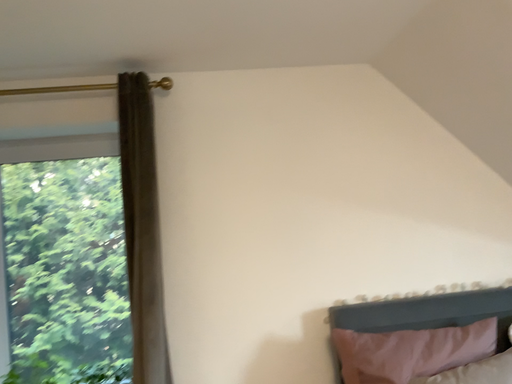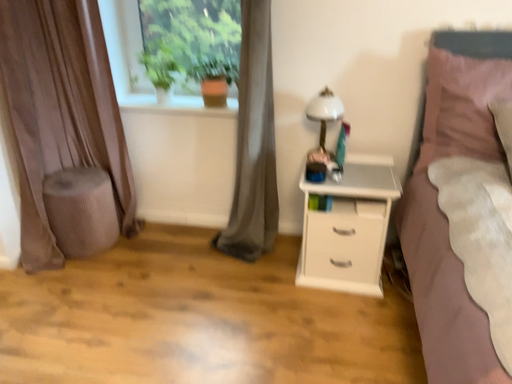
Question: Which way did the camera rotate in the video?

Choices:
 (A) rotated upward
 (B) rotated downward

Answer: (B)